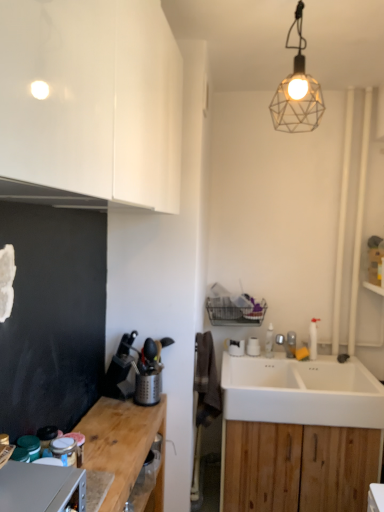
Question: From a real-world perspective, is white wood cabinet at lower right, positioned as the 2th cabinetry in front-to-back order, physically located above or below satin silver metallic fridge at lower left, which is the 1th appliance in front-to-back order?

Choices:
 (A) below
 (B) above

Answer: (A)

Question: Is white wood cabinet at lower right, positioned as the 2th cabinetry in front-to-back order, spatially inside satin silver metallic fridge at lower left, which is the 1th appliance in front-to-back order, or outside of it?

Choices:
 (A) inside
 (B) outside

Answer: (B)

Question: Which object is positioned farthest from the white ceramic sink at lower right?

Choices:
 (A) white wood cabinet at lower right, positioned as the 2th cabinetry in front-to-back order
 (B) metallic wireframe lamp at upper center
 (C) wooden at left
 (D) glossy white cabinet at upper left, the 1th cabinetry in the left-to-right sequence
 (E) metallic grater at left, the first appliance from the back

Answer: (B)

Question: Which object is the farthest from the white ceramic sink at lower right?

Choices:
 (A) glossy white cabinet at upper left, which is counted as the second cabinetry, starting from the back
 (B) white wood cabinet at lower right, which is counted as the 1th cabinetry, starting from the bottom
 (C) metallic grater at left, which appears as the third appliance when viewed from the front
 (D) metallic wireframe lamp at upper center
 (E) satin silver metallic fridge at lower left, which is the 1th appliance in front-to-back order

Answer: (D)